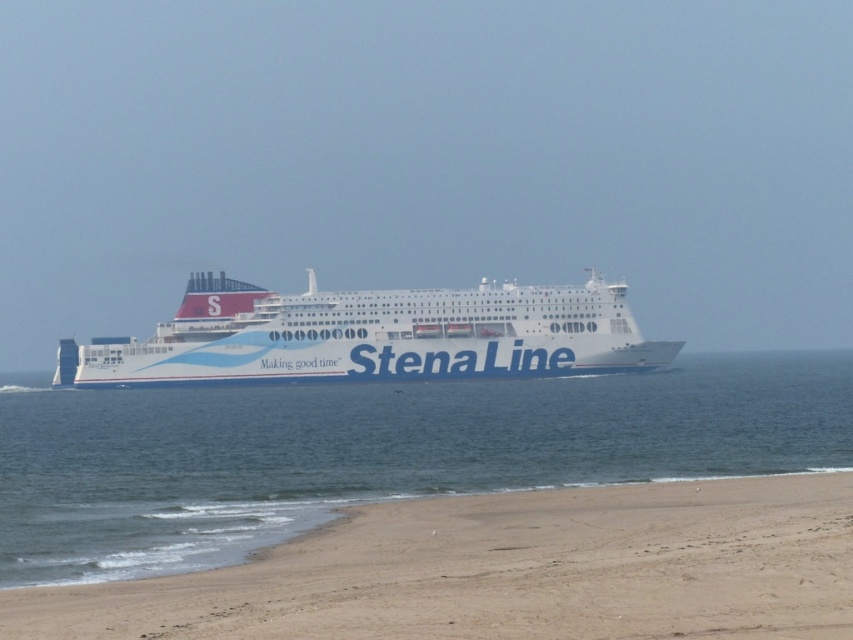
Between fine-grained sand at lower center and white glossy cruise ship at center, which one is positioned lower?

fine-grained sand at lower center is lower down.

Can you confirm if fine-grained sand at lower center is thinner than white glossy cruise ship at center?

Yes.

Which is in front, point (223, 576) or point (473, 291)?

Point (223, 576) is in front.

At what (x,y) coordinates should I click in order to perform the action: click on fine-grained sand at lower center. Please return your answer as a coordinate pair (x, y). Image resolution: width=853 pixels, height=640 pixels. Looking at the image, I should click on (508, 572).

Who is positioned more to the left, white water at center or white glossy cruise ship at center?

white glossy cruise ship at center is more to the left.

Can you confirm if white water at center is bigger than white glossy cruise ship at center?

No, white water at center is not bigger than white glossy cruise ship at center.

Does point (386, 474) come farther from viewer compared to point (392, 316)?

No, it is not.

I want to click on white water at center, so click(x=374, y=451).

Who is lower down, white water at center or fine-grained sand at lower center?

white water at center

Is point (250, 486) farther from camera compared to point (96, 600)?

That is True.

Find the location of a particular element. This screenshot has height=640, width=853. white water at center is located at coordinates 374,451.